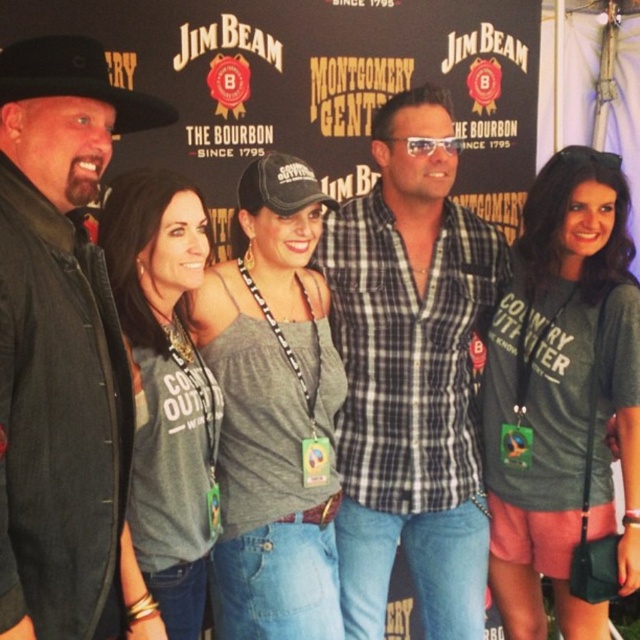
You are a photographer adjusting the lighting for a group photo. You notice the gray fabric shirt at center and the black felt cowboy hat at upper left. Which object should you focus on first if you want to ensure both receive equal lighting, considering their sizes?

The gray fabric shirt at center has a greater height compared to the black felt cowboy hat at upper left, so you should focus on lighting the gray fabric shirt at center first to ensure both receive equal illumination based on their size.

You are standing in front of the Jim Beam and Montgomery backdrop. There are two points marked on the backdrop at coordinates point (x=177, y=429) and point (x=51, y=58). If you want to touch the point that is closer to you, which coordinate should you aim for?

Point (x=51, y=58) is closer to you than point (x=177, y=429), so you should aim for point (x=51, y=58).

You are a photographer trying to capture a closeup of the checkered fabric shirt at center and the gray fabric shirt at center. Which one should you focus on first to ensure it appears sharp in the photo?

You should focus on the checkered fabric shirt at center first because it is closer to you than the gray fabric shirt at center, so it will appear sharp if focused on first.